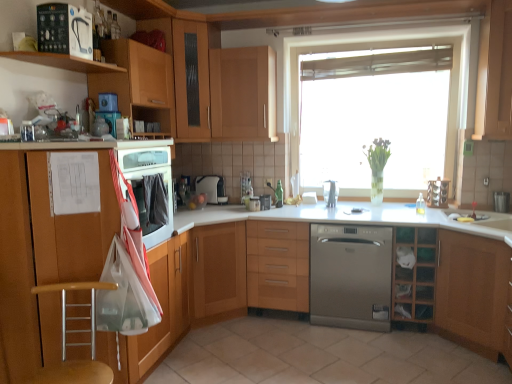
At what (x,y) coordinates should I click in order to perform the action: click on free space in front of satin nickel faucet at center, the 1th appliance when ordered from right to left. Please return your answer as a coordinate pair (x, y). Looking at the image, I should click on (334, 211).